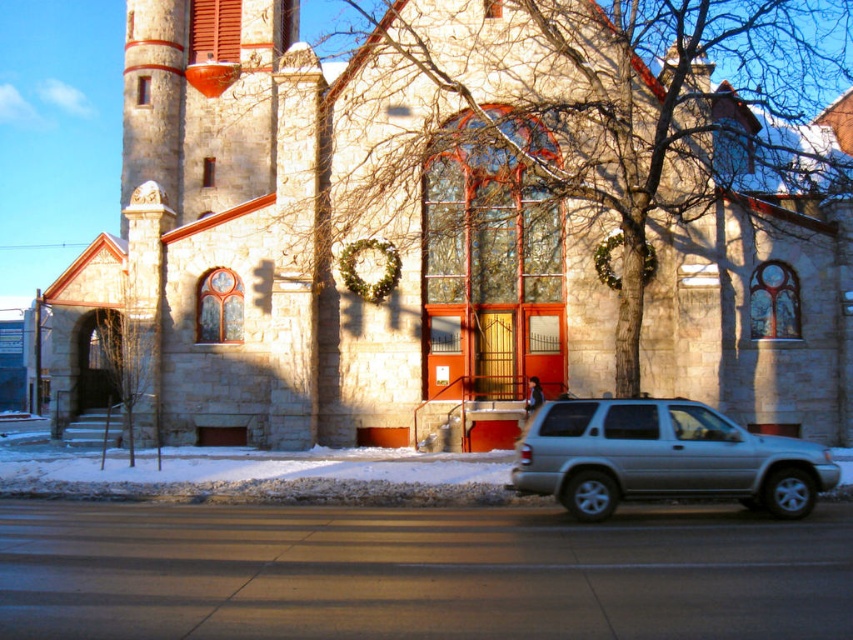
Question: Is stone church at center wider than silver metallic suv at lower right?

Choices:
 (A) no
 (B) yes

Answer: (B)

Question: Is the position of stone church at center less distant than that of silver metallic suv at lower right?

Choices:
 (A) no
 (B) yes

Answer: (A)

Question: Which point appears closest to the camera in this image?

Choices:
 (A) (724, 496)
 (B) (256, 289)

Answer: (A)

Question: Which of the following is the farthest from the observer?

Choices:
 (A) silver metallic suv at lower right
 (B) stone church at center

Answer: (B)

Question: Does stone church at center appear under silver metallic suv at lower right?

Choices:
 (A) yes
 (B) no

Answer: (B)